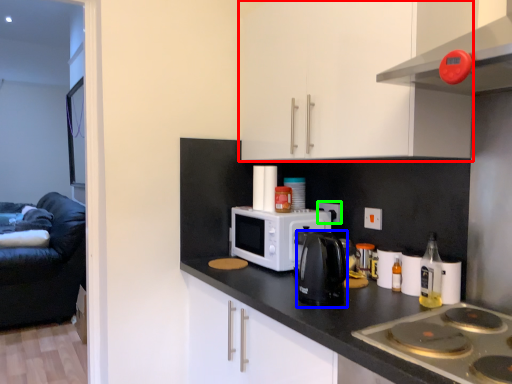
Question: Considering the real-world distances, which object is farthest from cabinetry (highlighted by a red box)? kitchen appliance (highlighted by a blue box) or electric outlet (highlighted by a green box)?

Choices:
 (A) kitchen appliance
 (B) electric outlet

Answer: (B)